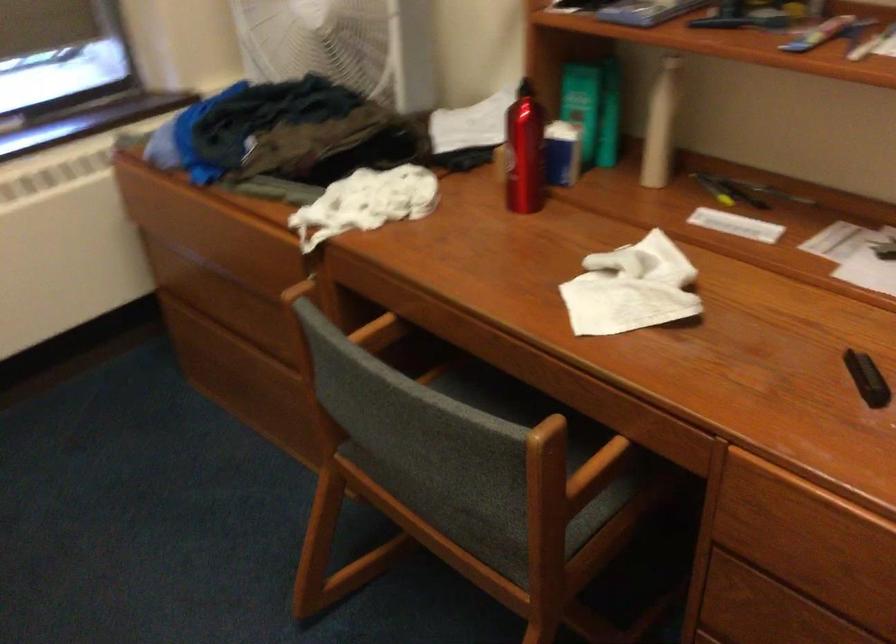
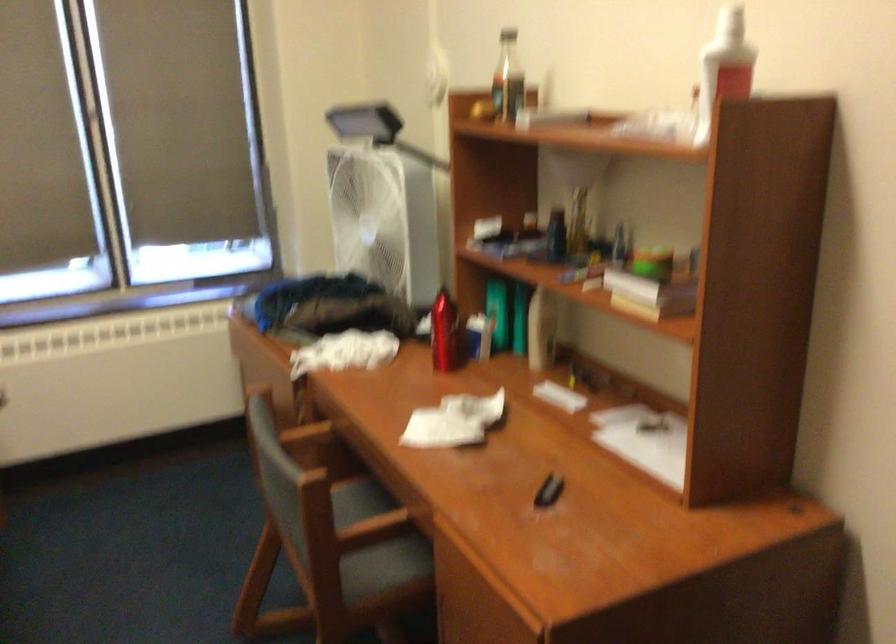
Locate, in the second image, the point that corresponds to (x=595, y=489) in the first image.

(375, 545)